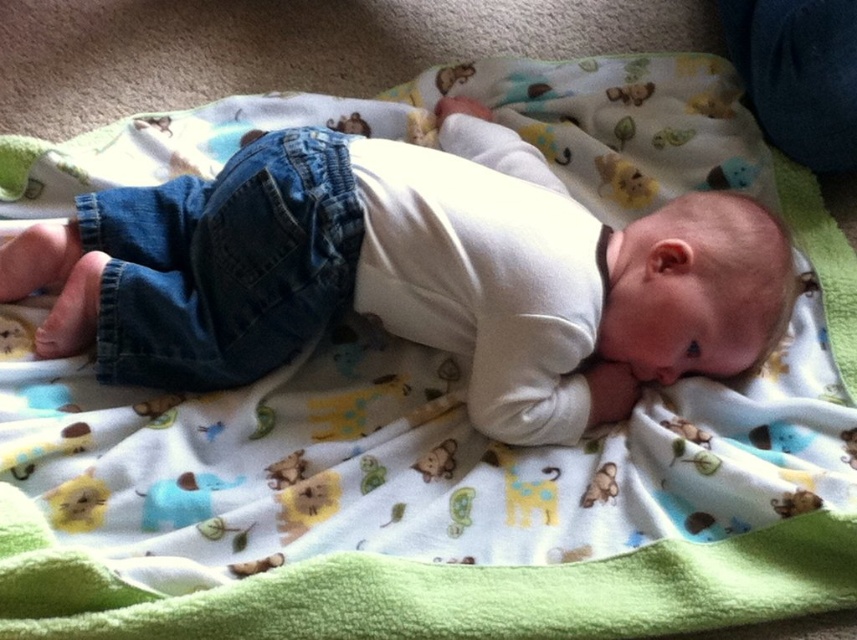
Consider the image. Does white soft baby at center appear on the left side of denim pants at left?

In fact, white soft baby at center is to the right of denim pants at left.

Between point (241, 204) and point (268, 259), which one is positioned behind?

The point (241, 204) is more distant.

Find the location of a particular element. The image size is (857, 640). white soft baby at center is located at coordinates tap(409, 275).